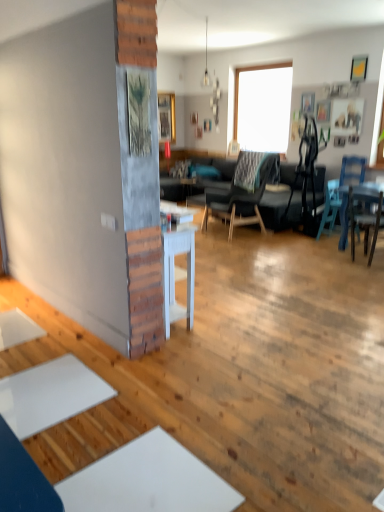
Locate an element on the screen. This screenshot has height=512, width=384. wooden picture frame at upper right, the second picture frame positioned from the right is located at coordinates (347, 116).

How much space does wooden textured picture frame at center, the sixth picture frame viewed from the back, occupy horizontally?

wooden textured picture frame at center, the sixth picture frame viewed from the back, is 1.01 inches in width.

Describe the element at coordinates (307, 102) in the screenshot. This screenshot has height=512, width=384. I see `wooden picture frame at upper right, placed as the 4th picture frame when sorted from right to left` at that location.

Find the location of a particular element. wooden picture frame at upper right, which ranks as the third picture frame in front-to-back order is located at coordinates click(x=347, y=116).

From the image's perspective, is white painted wood table at center on top of wooden picture frame at upper right, positioned as the 5th picture frame in front-to-back order?

Incorrect, from the image's perspective, white painted wood table at center is lower than wooden picture frame at upper right, positioned as the 5th picture frame in front-to-back order.

Is white painted wood table at center taller than wooden picture frame at upper right, the 4th picture frame positioned from the bottom?

Indeed, white painted wood table at center has a greater height compared to wooden picture frame at upper right, the 4th picture frame positioned from the bottom.

Is wooden picture frame at upper right, positioned as the 5th picture frame in front-to-back order, at the back of white painted wood table at center?

white painted wood table at center does not have its back to wooden picture frame at upper right, positioned as the 5th picture frame in front-to-back order.

Is white painted wood table at center placed right next to dark gray fabric chair at center, which is counted as the third chair, starting from the right?

There is a gap between white painted wood table at center and dark gray fabric chair at center, which is counted as the third chair, starting from the right.

You are a GUI agent. You are given a task and a screenshot of the screen. Output one action in this format:
    pyautogui.click(x=<x>, y=<y>)
    Task: Click on the table lying in front of the dark gray fabric chair at center, marked as the first chair in a left-to-right arrangement
    
    Given the screenshot: What is the action you would take?
    pyautogui.click(x=173, y=262)

Which is more to the right, white painted wood table at center or dark gray fabric chair at center, marked as the first chair in a left-to-right arrangement?

dark gray fabric chair at center, marked as the first chair in a left-to-right arrangement, is more to the right.

Between wooden textured picture frame at center, the 1th picture frame when ordered from front to back, and blue wooden chair at right, which appears as the third chair when viewed from the left, which one has more height?

blue wooden chair at right, which appears as the third chair when viewed from the left, is taller.

The height and width of the screenshot is (512, 384). What are the coordinates of `the 1st picture frame positioned above the blue wooden chair at right, which appears as the third chair when viewed from the left (from the image's perspective)` in the screenshot? It's located at (139, 113).

Is wooden textured picture frame at center, arranged as the 2th picture frame when viewed from the left, directly adjacent to blue wooden chair at right, the 1th chair positioned from the right?

wooden textured picture frame at center, arranged as the 2th picture frame when viewed from the left, and blue wooden chair at right, the 1th chair positioned from the right, are clearly separated.

From the image's perspective, which is above, blue plastic chair at right, the second chair from the right, or white painted wood table at center?

blue plastic chair at right, the second chair from the right, appears higher in the image.

Is there a large distance between blue plastic chair at right, the second chair from the right, and white painted wood table at center?

blue plastic chair at right, the second chair from the right, is far away from white painted wood table at center.

How many degrees apart are the facing directions of blue plastic chair at right, the second chair from the right, and white painted wood table at center?

The angular difference between blue plastic chair at right, the second chair from the right, and white painted wood table at center is 87.1 degrees.

From a real-world perspective, is blue plastic chair at right, the 2th chair from the left, physically located above or below white painted wood table at center?

blue plastic chair at right, the 2th chair from the left, is below white painted wood table at center.

Image resolution: width=384 pixels, height=512 pixels. What are the coordinates of `the 2nd picture frame to the left when counting from the white painted wood table at center` in the screenshot? It's located at [x=167, y=117].

Considering the relative sizes of wooden picture frame at center, which is the sixth picture frame in right-to-left order, and white painted wood table at center in the image provided, is wooden picture frame at center, which is the sixth picture frame in right-to-left order, wider than white painted wood table at center?

In fact, wooden picture frame at center, which is the sixth picture frame in right-to-left order, might be narrower than white painted wood table at center.

From the picture: Does wooden picture frame at center, the 1th picture frame positioned from the back, have a greater height compared to white painted wood table at center?

Yes.

Which is in front, wooden picture frame at center, marked as the 6th picture frame in a front-to-back arrangement, or white painted wood table at center?

white painted wood table at center is more forward.

Would you say dark gray fabric couch at center is to the left or to the right of wooden picture frame at upper right, the fifth picture frame from the left, in the picture?

dark gray fabric couch at center is to the left of wooden picture frame at upper right, the fifth picture frame from the left.

From a real-world perspective, does dark gray fabric couch at center stand above wooden picture frame at upper right, which ranks as the third picture frame in front-to-back order?

Incorrect, from a real-world perspective, dark gray fabric couch at center is lower than wooden picture frame at upper right, which ranks as the third picture frame in front-to-back order.

Considering their positions, is dark gray fabric couch at center located in front of or behind wooden picture frame at upper right, which appears as the 2th picture frame when ordered from the bottom?

dark gray fabric couch at center is positioned closer to the viewer than wooden picture frame at upper right, which appears as the 2th picture frame when ordered from the bottom.

Where is `the 1st chair positioned below the wooden picture frame at upper right, the third picture frame when ordered from back to front (from the image's perspective)`? This screenshot has height=512, width=384. the 1st chair positioned below the wooden picture frame at upper right, the third picture frame when ordered from back to front (from the image's perspective) is located at coordinates (241, 194).

Would you say dark gray fabric chair at center, marked as the first chair in a left-to-right arrangement, is part of wooden picture frame at upper right, which is counted as the 4th picture frame, starting from the front,'s contents?

No.

From the image's perspective, is wooden picture frame at upper right, the third picture frame when ordered from back to front, on dark gray fabric chair at center, which is counted as the third chair, starting from the right?

Yes, from the image's perspective, wooden picture frame at upper right, the third picture frame when ordered from back to front, is on top of dark gray fabric chair at center, which is counted as the third chair, starting from the right.

Locate an element on the screen. The width and height of the screenshot is (384, 512). table that appears below the wooden picture frame at upper right, acting as the 2th picture frame starting from the back (from a real-world perspective) is located at coordinates (173, 262).

From a real-world perspective, which chair is the 2nd one above the white painted wood table at center? Please provide its 2D coordinates.

[(241, 194)]

Based on their spatial positions, is dark gray fabric chair at center, marked as the first chair in a left-to-right arrangement, or white painted wood table at center further from wooden textured picture frame at center, the 1th picture frame when ordered from front to back?

The object further to wooden textured picture frame at center, the 1th picture frame when ordered from front to back, is dark gray fabric chair at center, marked as the first chair in a left-to-right arrangement.

Looking at this image, when comparing their distances from wooden picture frame at upper right, which is counted as the 4th picture frame, starting from the front, does dark gray fabric chair at center, marked as the first chair in a left-to-right arrangement, or white painted wood table at center seem closer?

Among the two, dark gray fabric chair at center, marked as the first chair in a left-to-right arrangement, is located nearer to wooden picture frame at upper right, which is counted as the 4th picture frame, starting from the front.

Considering their positions, is blue plastic chair at right, the second chair from the right, positioned closer to white painted wood table at center than wooden picture frame at upper right, which appears as the 1th picture frame when viewed from the right?

The object closer to white painted wood table at center is blue plastic chair at right, the second chair from the right.

From the picture: Estimate the real-world distances between objects in this image. Which object is further from wooden picture frame at upper right, which ranks as the fifth picture frame in back-to-front order, blue plastic chair at right, the second chair from the right, or dark gray fabric chair at center, which is counted as the third chair, starting from the right?

dark gray fabric chair at center, which is counted as the third chair, starting from the right, is further to wooden picture frame at upper right, which ranks as the fifth picture frame in back-to-front order.

Looking at the image, which one is located further to blue wooden chair at right, which appears as the third chair when viewed from the left, blue plastic chair at right, the 2th chair from the left, or wooden picture frame at upper right, the third picture frame when ordered from back to front?

Among the two, wooden picture frame at upper right, the third picture frame when ordered from back to front, is located further to blue wooden chair at right, which appears as the third chair when viewed from the left.

When comparing their distances from wooden picture frame at upper right, the 4th picture frame positioned from the bottom, does blue wooden chair at right, which appears as the third chair when viewed from the left, or white painted wood table at center seem further?

Based on the image, white painted wood table at center appears to be further to wooden picture frame at upper right, the 4th picture frame positioned from the bottom.

Based on their spatial positions, is wooden picture frame at upper right, which appears as the 1th picture frame when viewed from the right, or dark gray fabric couch at center further from wooden textured picture frame at center, which is the 6th picture frame from top to bottom?

The object further to wooden textured picture frame at center, which is the 6th picture frame from top to bottom, is wooden picture frame at upper right, which appears as the 1th picture frame when viewed from the right.

From the image, which object appears to be farther from wooden picture frame at upper right, the sixth picture frame positioned from the left, white painted wood table at center or dark gray fabric couch at center?

white painted wood table at center.

At what (x,y) coordinates should I click in order to perform the action: click on studio couch positioned between wooden textured picture frame at center, marked as the first picture frame in a bottom-to-top arrangement, and wooden picture frame at upper right, the sixth picture frame positioned from the left, from near to far. Please return your answer as a coordinate pair (x, y). Looking at the image, I should click on (282, 202).

What are the coordinates of `table between wooden textured picture frame at center, which is the 6th picture frame from top to bottom, and wooden picture frame at upper right, positioned as the 5th picture frame in front-to-back order, in the front-back direction` in the screenshot? It's located at (173, 262).

Where is `studio couch between wooden textured picture frame at center, which is the 6th picture frame from top to bottom, and wooden picture frame at center, the 1th picture frame positioned from the back, from front to back`? The height and width of the screenshot is (512, 384). studio couch between wooden textured picture frame at center, which is the 6th picture frame from top to bottom, and wooden picture frame at center, the 1th picture frame positioned from the back, from front to back is located at coordinates (282, 202).

This screenshot has width=384, height=512. What are the coordinates of `chair between wooden picture frame at upper right, the 3th picture frame in the top-to-bottom sequence, and blue plastic chair at right, the second chair from the right, in the vertical direction` in the screenshot? It's located at (241, 194).